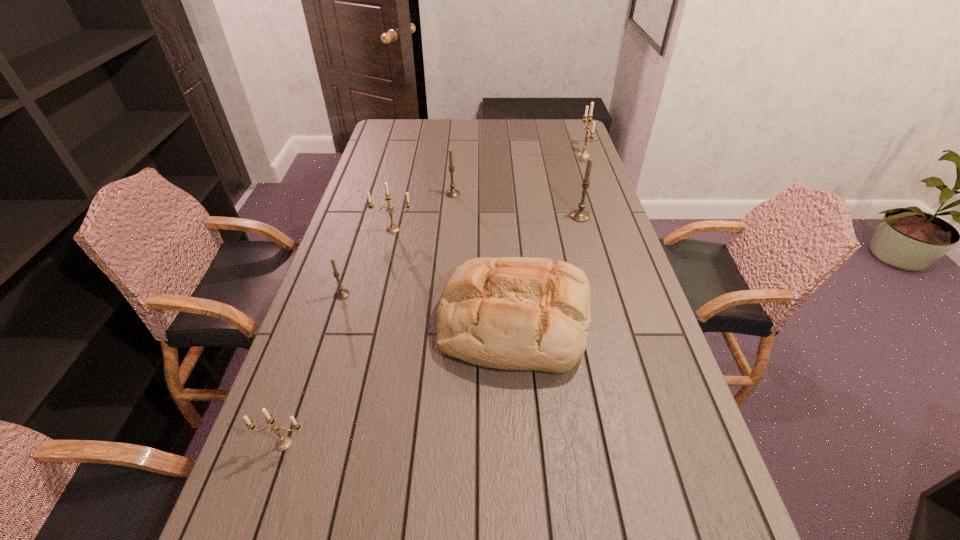
At what (x,y) coordinates should I click in order to perform the action: click on free location at the far edge. Please return your answer as a coordinate pair (x, y). The width and height of the screenshot is (960, 540). Looking at the image, I should click on (444, 126).

This screenshot has height=540, width=960. I want to click on free space at the left edge of the desktop, so click(375, 176).

You are a GUI agent. You are given a task and a screenshot of the screen. Output one action in this format:
    pyautogui.click(x=<x>, y=<y>)
    Task: Click on the vacant area at the right edge
    Image resolution: width=960 pixels, height=540 pixels.
    Given the screenshot: What is the action you would take?
    pyautogui.click(x=674, y=465)

Find the location of a particular element. free space at the far left corner of the desktop is located at coordinates (377, 135).

In the image, there is a desktop. At what (x,y) coordinates should I click in order to perform the action: click on vacant region at the far right corner. Please return your answer as a coordinate pair (x, y). The height and width of the screenshot is (540, 960). Looking at the image, I should click on (577, 137).

Where is `free point between the second nearest candle and the farthest gray candle`? The width and height of the screenshot is (960, 540). free point between the second nearest candle and the farthest gray candle is located at coordinates (397, 244).

I want to click on free space between the fifth farthest candle and the farthest candle, so click(x=463, y=225).

Where is `empty location between the fifth farthest candle and the biggest metallic candle`? empty location between the fifth farthest candle and the biggest metallic candle is located at coordinates (463, 225).

At what (x,y) coordinates should I click in order to perform the action: click on free spot between the rightmost object and the second nearest metallic candle. Please return your answer as a coordinate pair (x, y). The height and width of the screenshot is (540, 960). Looking at the image, I should click on (489, 193).

Identify the location of free space between the nearest gray candle and the second nearest metallic candle. (368, 262).